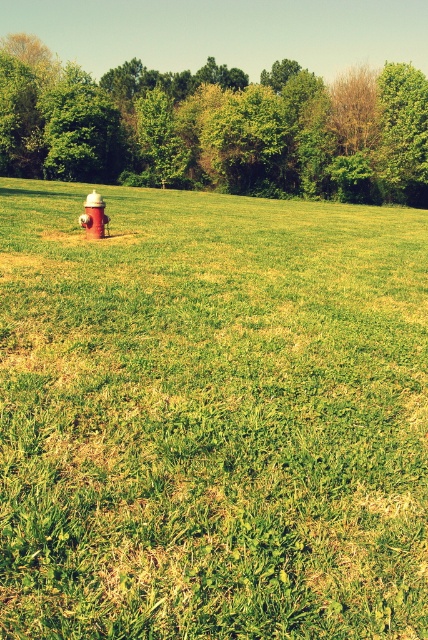
Question: Can you confirm if green leafy tree at upper center is smaller than red painted hydrant at center?

Choices:
 (A) yes
 (B) no

Answer: (B)

Question: Which of these objects is positioned closest to the green leafy tree at upper center?

Choices:
 (A) green grassy field at center
 (B) red painted hydrant at center

Answer: (A)

Question: Which point appears farthest from the camera in this image?

Choices:
 (A) 143,499
 (B) 104,216

Answer: (B)

Question: From the image, what is the correct spatial relationship of green leafy tree at upper center in relation to red painted hydrant at center?

Choices:
 (A) right
 (B) left

Answer: (B)

Question: Is green grassy field at center above red painted hydrant at center?

Choices:
 (A) yes
 (B) no

Answer: (B)

Question: Which object appears farthest from the camera in this image?

Choices:
 (A) green leafy tree at upper center
 (B) red painted hydrant at center
 (C) green grassy field at center

Answer: (A)